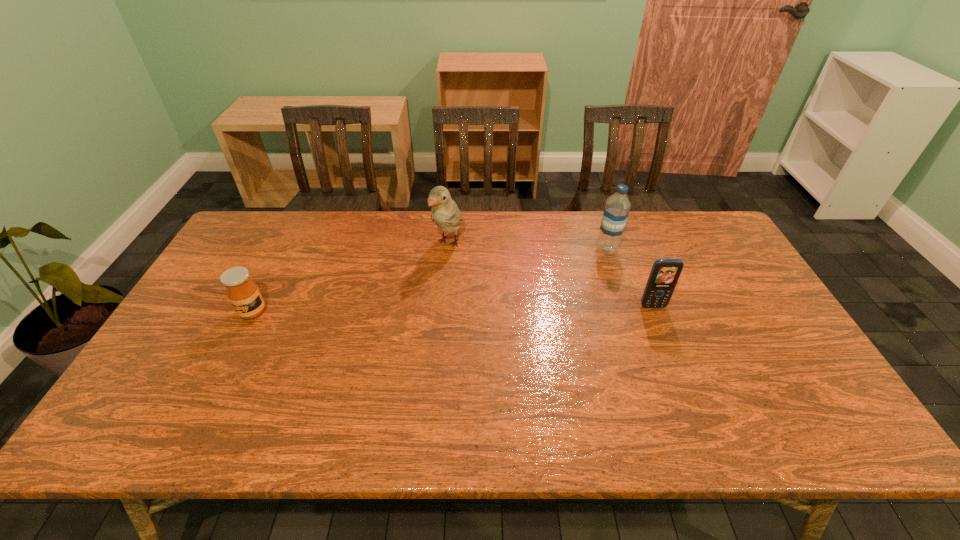
This screenshot has width=960, height=540. I want to click on vacant region at the right edge of the desktop, so click(x=731, y=341).

This screenshot has height=540, width=960. Identify the location of vacant space at the far left corner of the desktop. (251, 227).

Find the location of a particular element. This screenshot has height=540, width=960. vacant space at the near right corner of the desktop is located at coordinates (761, 388).

Where is `unoccupied position between the rightmost object and the honey`? This screenshot has height=540, width=960. unoccupied position between the rightmost object and the honey is located at coordinates (x=453, y=309).

Find the location of `free area in between the cellular telephone and the shortest object`. free area in between the cellular telephone and the shortest object is located at coordinates (453, 309).

Find the location of `free area in between the shortest object and the second object from right to left`. free area in between the shortest object and the second object from right to left is located at coordinates (430, 281).

Image resolution: width=960 pixels, height=540 pixels. Find the location of `free point between the bird and the rightmost object`. free point between the bird and the rightmost object is located at coordinates (551, 275).

This screenshot has height=540, width=960. Identify the location of empty space that is in between the water bottle and the cellular telephone. (630, 278).

At what (x,y) coordinates should I click in order to perform the action: click on free space that is in between the second shortest object and the second object from right to left. Please return your answer as a coordinate pair (x, y). Looking at the image, I should click on (630, 278).

Identify the location of free spot between the third object from right to left and the third tallest object. This screenshot has height=540, width=960. (551, 275).